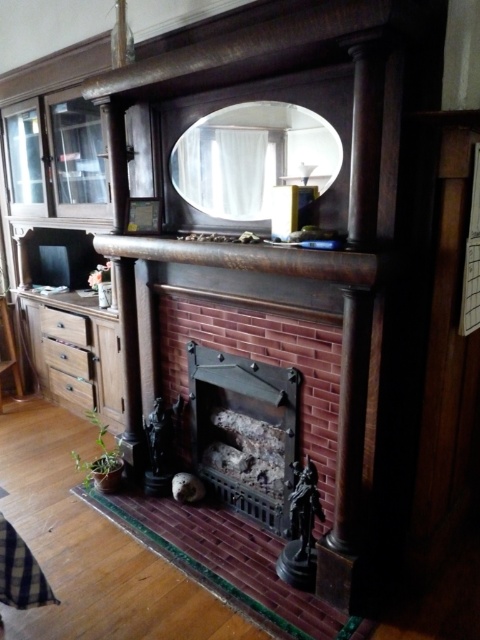
Question: Based on their relative distances, which object is nearer to the wooden drawer at lower left?

Choices:
 (A) matte glass mirror at upper center
 (B) wooden drawer at left
 (C) rustic brick fireplace at center
 (D) matte brown drawer at lower left

Answer: (D)

Question: Does rustic brick fireplace at center lie behind wooden drawer at left?

Choices:
 (A) yes
 (B) no

Answer: (B)

Question: Does wooden drawer at lower left have a greater width compared to matte brown drawer at lower left?

Choices:
 (A) no
 (B) yes

Answer: (B)

Question: Observing the image, what is the correct spatial positioning of rustic brick fireplace at center in reference to wooden drawer at left?

Choices:
 (A) right
 (B) left

Answer: (A)

Question: Which of the following is the farthest from the observer?

Choices:
 (A) wooden drawer at lower left
 (B) dark wood mantle at center
 (C) rustic brick fireplace at center

Answer: (A)

Question: Which point is farther from the camera taking this photo?

Choices:
 (A) (84, 324)
 (B) (375, 280)

Answer: (A)